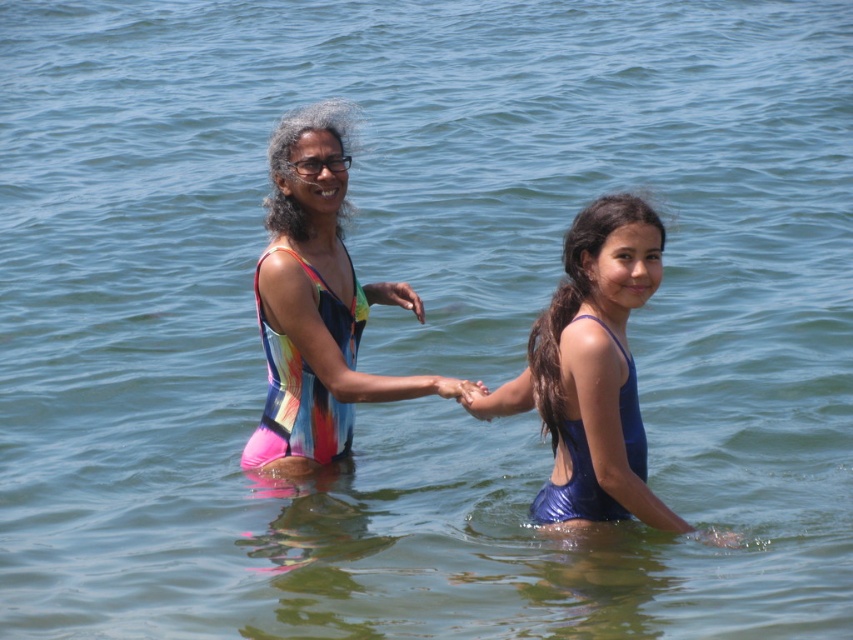
Can you confirm if blue shiny swimsuit at center is positioned to the right of matte plastic hand at center?

Correct, you'll find blue shiny swimsuit at center to the right of matte plastic hand at center.

Can you confirm if blue shiny swimsuit at center is smaller than matte plastic hand at center?

No, blue shiny swimsuit at center is not smaller than matte plastic hand at center.

Describe the element at coordinates (595, 358) in the screenshot. I see `blue shiny swimsuit at center` at that location.

This screenshot has width=853, height=640. Identify the location of blue shiny swimsuit at center. (595, 358).

Where is `matte plastic hand at center`? This screenshot has height=640, width=853. matte plastic hand at center is located at coordinates (393, 296).

Can you confirm if matte plastic hand at center is positioned to the left of matte skin hand at center?

Yes, matte plastic hand at center is to the left of matte skin hand at center.

Between point (381, 294) and point (437, 390), which one is positioned behind?

Positioned behind is point (381, 294).

This screenshot has height=640, width=853. What are the coordinates of `matte plastic hand at center` in the screenshot? It's located at (393, 296).

Does blue shiny swimsuit at center have a lesser width compared to matte blue swimsuit at center?

No, blue shiny swimsuit at center is not thinner than matte blue swimsuit at center.

Describe the element at coordinates (595, 358) in the screenshot. This screenshot has width=853, height=640. I see `blue shiny swimsuit at center` at that location.

Where is `blue shiny swimsuit at center`? blue shiny swimsuit at center is located at coordinates (595, 358).